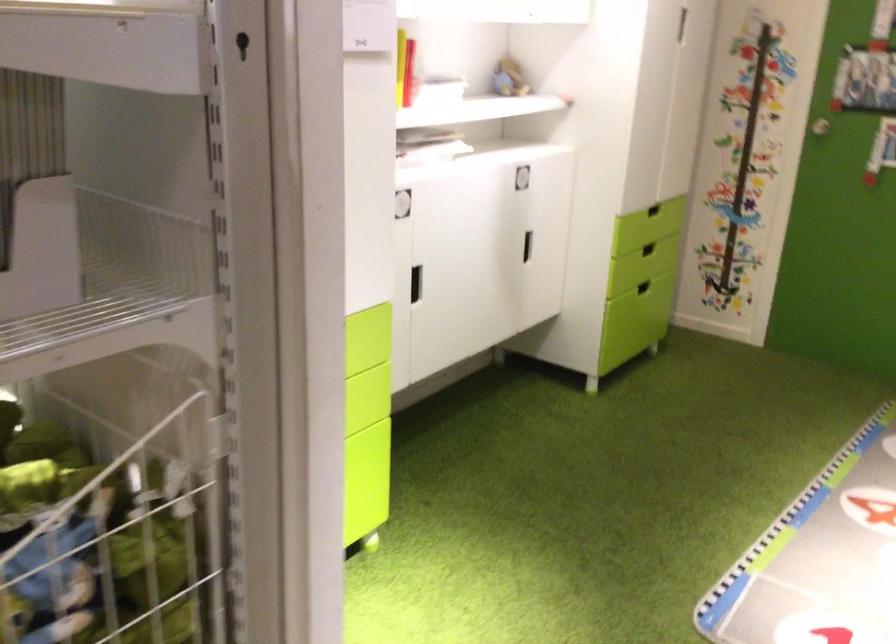
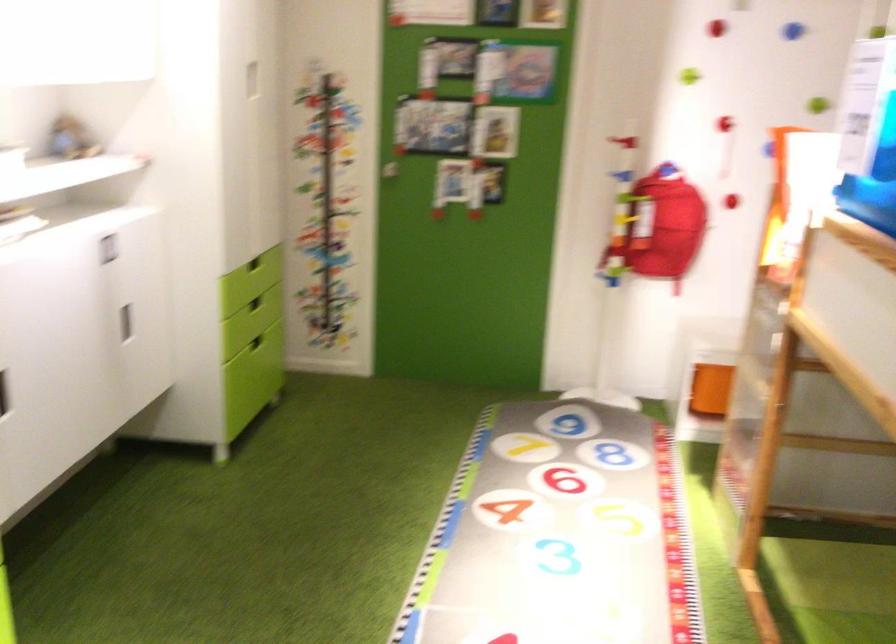
In the second image, find the point that corresponds to point (650, 286) in the first image.

(255, 342)